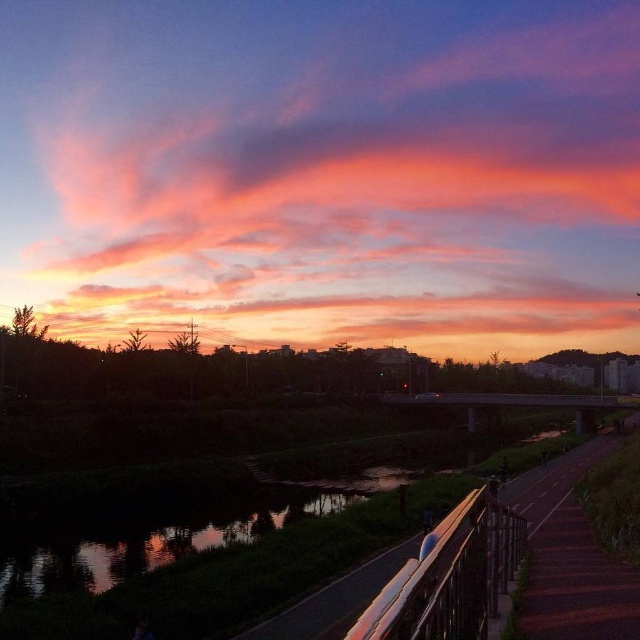
Question: Is satin silver railing at lower center above reflective glass water at center?

Choices:
 (A) no
 (B) yes

Answer: (B)

Question: Is satin silver railing at lower center to the right of reflective glass water at center from the viewer's perspective?

Choices:
 (A) no
 (B) yes

Answer: (B)

Question: Among these objects, which one is farthest from the camera?

Choices:
 (A) satin silver railing at lower center
 (B) reflective glass water at center
 (C) smooth asphalt path at lower right

Answer: (B)

Question: Which object is positioned closest to the reflective glass water at center?

Choices:
 (A) smooth asphalt path at lower right
 (B) satin silver railing at lower center

Answer: (A)

Question: Among these objects, which one is farthest from the camera?

Choices:
 (A) smooth asphalt path at lower right
 (B) satin silver railing at lower center
 (C) reflective glass water at center

Answer: (C)

Question: Observing the image, what is the correct spatial positioning of satin silver railing at lower center in reference to reflective glass water at center?

Choices:
 (A) left
 (B) right

Answer: (B)